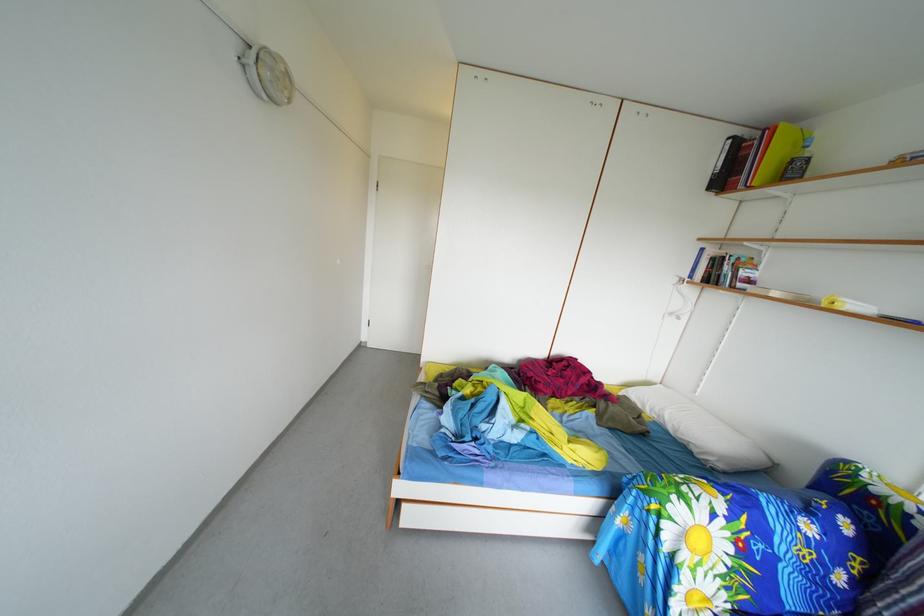
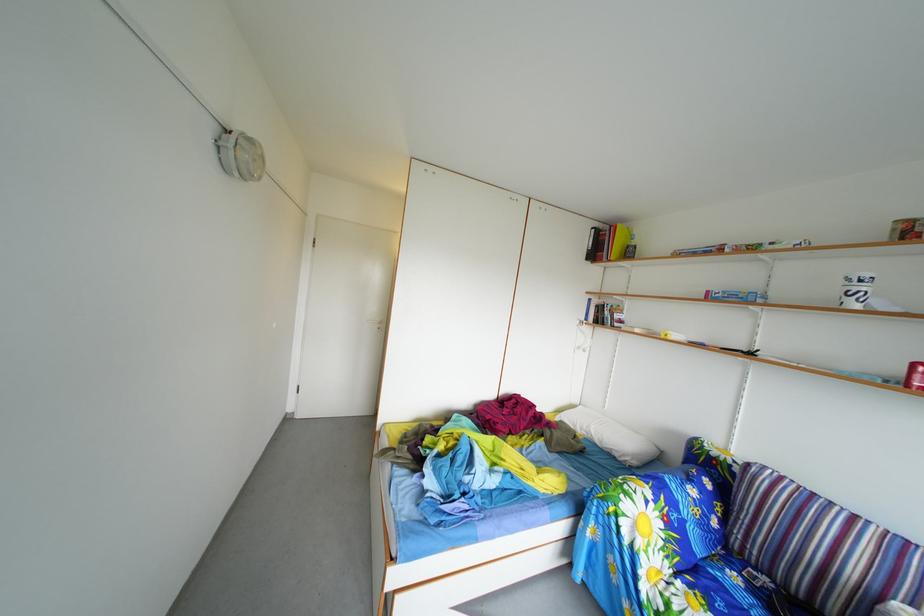
In the second image, find the point that corresponds to the point at 687,440 in the first image.

(612, 451)